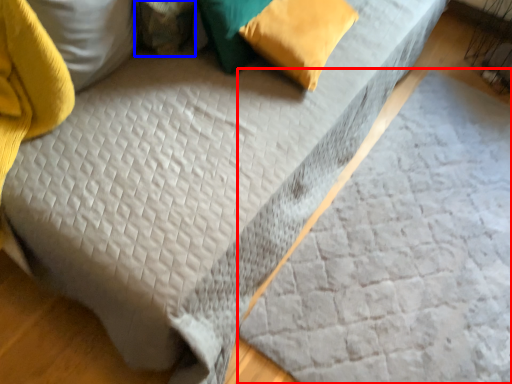
Question: Which object is closer to the camera taking this photo, sheet (highlighted by a red box) or pillow (highlighted by a blue box)?

Choices:
 (A) sheet
 (B) pillow

Answer: (A)